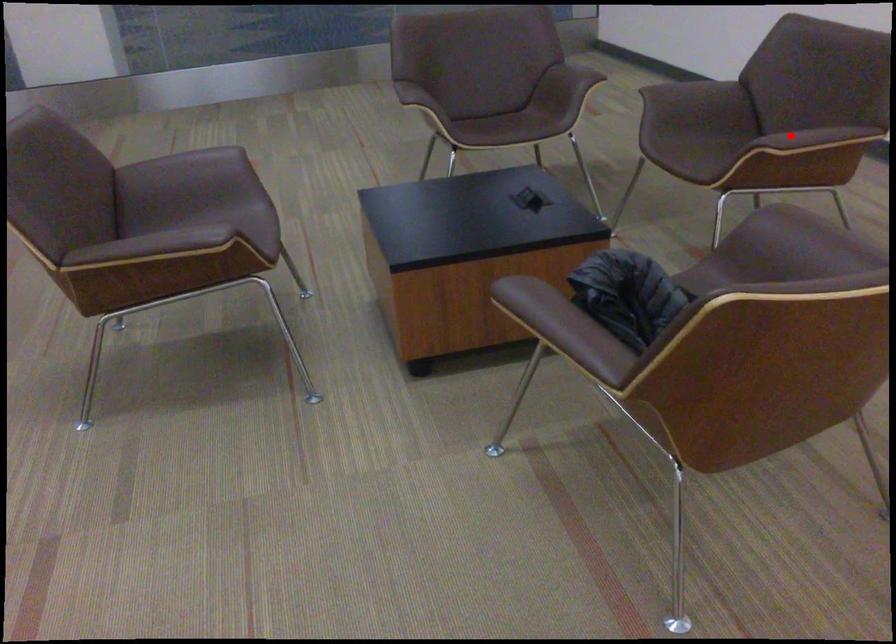
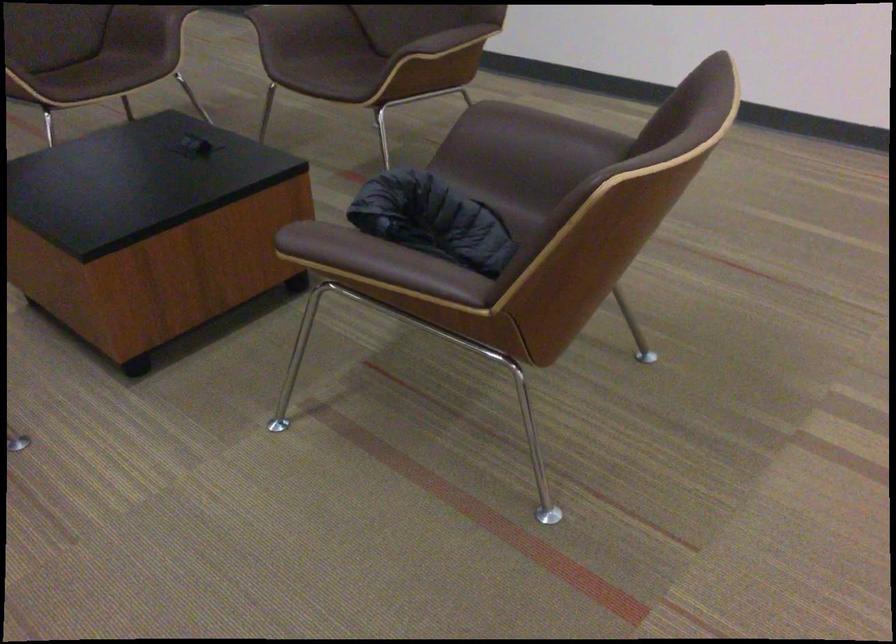
In the second image, find the point that corresponds to the highlighted location in the first image.

(444, 46)